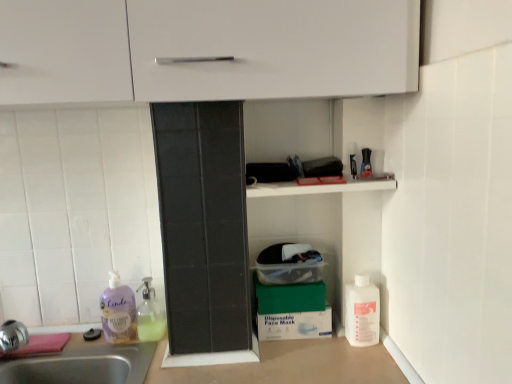
Question: From a real-world perspective, is translucent glass soap dispenser at lower left, the second cleaning product viewed from the left, over green matte box at lower center?

Choices:
 (A) no
 (B) yes

Answer: (A)

Question: Is translucent glass soap dispenser at lower left, marked as the 2th cleaning product in a right-to-left arrangement, facing away from green matte box at lower center?

Choices:
 (A) no
 (B) yes

Answer: (A)

Question: Considering the relative sizes of translucent glass soap dispenser at lower left, the second cleaning product viewed from the left, and green matte box at lower center in the image provided, is translucent glass soap dispenser at lower left, the second cleaning product viewed from the left, taller than green matte box at lower center?

Choices:
 (A) yes
 (B) no

Answer: (A)

Question: Is translucent glass soap dispenser at lower left, marked as the 2th cleaning product in a right-to-left arrangement, at the right side of green matte box at lower center?

Choices:
 (A) yes
 (B) no

Answer: (B)

Question: From the image's perspective, is translucent glass soap dispenser at lower left, the second cleaning product viewed from the left, below green matte box at lower center?

Choices:
 (A) no
 (B) yes

Answer: (B)

Question: In the image, is translucent glass soap dispenser at lower left, the second cleaning product viewed from the left, positioned in front of or behind white plastic bottle at lower right, the 1th cleaning product from the right?

Choices:
 (A) behind
 (B) front

Answer: (A)

Question: Do you think translucent glass soap dispenser at lower left, the second cleaning product viewed from the left, is within white plastic bottle at lower right, the 1th cleaning product from the right, or outside of it?

Choices:
 (A) inside
 (B) outside

Answer: (B)

Question: Is translucent glass soap dispenser at lower left, marked as the 2th cleaning product in a right-to-left arrangement, to the left or to the right of white plastic bottle at lower right, which appears as the 3th cleaning product when viewed from the left, in the image?

Choices:
 (A) left
 (B) right

Answer: (A)

Question: Does point [x=147, y=304] appear closer or farther from the camera than point [x=354, y=283]?

Choices:
 (A) closer
 (B) farther

Answer: (B)

Question: Considering the positions of white plastic bottle at lower right, which appears as the 3th cleaning product when viewed from the left, and translucent glass soap dispenser at lower left, the second cleaning product viewed from the left, in the image, is white plastic bottle at lower right, which appears as the 3th cleaning product when viewed from the left, taller or shorter than translucent glass soap dispenser at lower left, the second cleaning product viewed from the left,?

Choices:
 (A) short
 (B) tall

Answer: (B)

Question: Is white plastic bottle at lower right, which appears as the 3th cleaning product when viewed from the left, bigger or smaller than translucent glass soap dispenser at lower left, the second cleaning product viewed from the left?

Choices:
 (A) big
 (B) small

Answer: (B)

Question: Is white plastic bottle at lower right, the 1th cleaning product from the right, in front of or behind translucent glass soap dispenser at lower left, the second cleaning product viewed from the left, in the image?

Choices:
 (A) behind
 (B) front

Answer: (B)

Question: In the image, is white plastic bottle at lower right, which appears as the 3th cleaning product when viewed from the left, on the left side or the right side of translucent glass soap dispenser at lower left, marked as the 2th cleaning product in a right-to-left arrangement?

Choices:
 (A) right
 (B) left

Answer: (A)

Question: From the image's perspective, is green matte box at lower center located above or below white plastic bottle at lower right, which appears as the 3th cleaning product when viewed from the left?

Choices:
 (A) above
 (B) below

Answer: (A)

Question: Based on their positions, is green matte box at lower center located to the left or right of white plastic bottle at lower right, the 1th cleaning product from the right?

Choices:
 (A) left
 (B) right

Answer: (A)